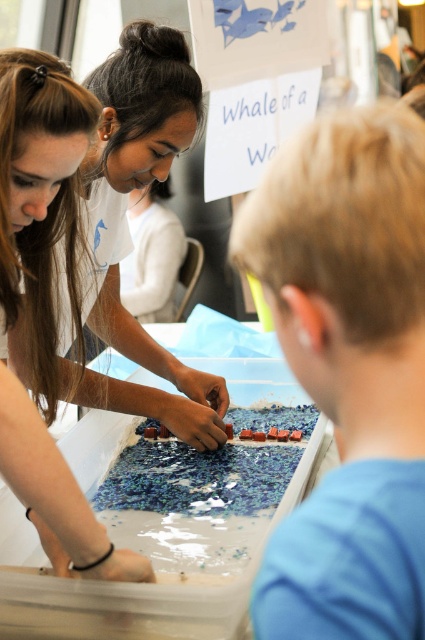
You are standing in front of the clear plastic container with water and colorful pieces. There are two points marked in the scene. Which point is closer to you, point (x=374, y=632) or point (x=91, y=397)?

Point (x=374, y=632) is closer to you than point (x=91, y=397).

You are an event organizer at the science fair. You need to determine if the blue matte puzzle pieces at right can fit into a slot that is the same width as the matte white shirt at upper left. Can they fit?

The blue matte puzzle pieces at right is thinner than the matte white shirt at upper left, so they can fit into the slot.